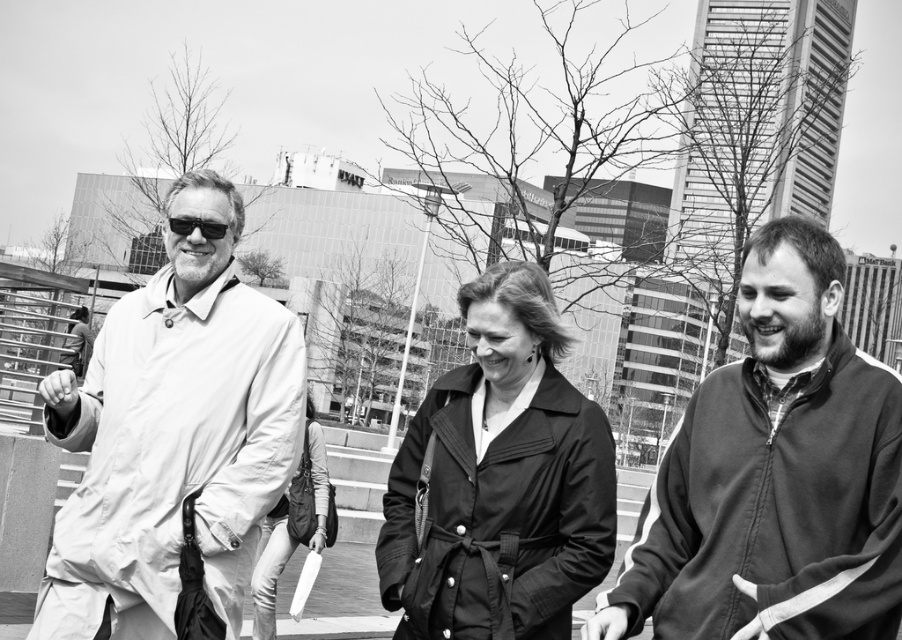
Can you confirm if matte white jacket at center is thinner than light beige fabric coat at left?

Correct, matte white jacket at center's width is less than light beige fabric coat at left's.

Does matte white jacket at center have a lesser height compared to light beige fabric coat at left?

Yes, matte white jacket at center is shorter than light beige fabric coat at left.

Who is more forward, (79,420) or (251,378)?

Point (79,420) is in front.

Where is `matte white jacket at center`? matte white jacket at center is located at coordinates (173, 432).

Between light beige fabric coat at left and matte black coat at center, which one appears on the right side from the viewer's perspective?

matte black coat at center

Between point (296, 323) and point (523, 634), which one is positioned in front?

Point (523, 634) is more forward.

Between point (111, 413) and point (448, 403), which one is positioned behind?

Point (448, 403)

Find the location of a particular element. Image resolution: width=902 pixels, height=640 pixels. light beige fabric coat at left is located at coordinates (172, 435).

Between matte black coat at center and matte black sunglasses at left, which one has more height?

With more height is matte black coat at center.

Which is behind, point (428, 529) or point (212, 221)?

The point (428, 529) is more distant.

At what (x,y) coordinates should I click in order to perform the action: click on matte black coat at center. Please return your answer as a coordinate pair (x, y). Looking at the image, I should click on (499, 480).

Identify the location of matte black coat at center. (499, 480).